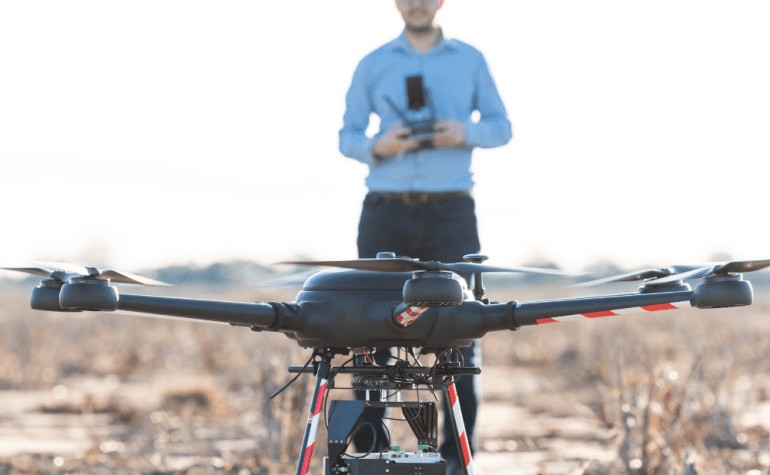
The image size is (770, 475). I want to click on remote, so click(423, 134).